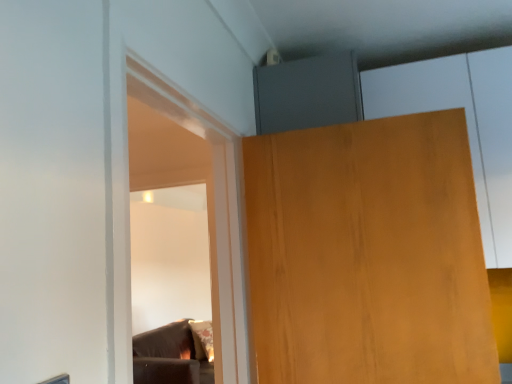
Question: Considering the positions of wooden door at upper right and matte wood cabinet at upper right in the image, is wooden door at upper right taller or shorter than matte wood cabinet at upper right?

Choices:
 (A) short
 (B) tall

Answer: (A)

Question: From a real-world perspective, is wooden door at upper right above or below matte wood cabinet at upper right?

Choices:
 (A) above
 (B) below

Answer: (B)

Question: Is wooden door at upper right to the left or to the right of matte wood cabinet at upper right in the image?

Choices:
 (A) right
 (B) left

Answer: (B)

Question: Looking at their shapes, would you say matte wood cabinet at upper right is wider or thinner than wooden door at upper right?

Choices:
 (A) thin
 (B) wide

Answer: (B)

Question: Is point (461, 77) positioned closer to the camera than point (300, 273)?

Choices:
 (A) closer
 (B) farther

Answer: (B)

Question: From the image's perspective, is matte wood cabinet at upper right located above or below wooden door at upper right?

Choices:
 (A) below
 (B) above

Answer: (B)

Question: Looking at the image, does matte wood cabinet at upper right seem bigger or smaller compared to wooden door at upper right?

Choices:
 (A) big
 (B) small

Answer: (A)